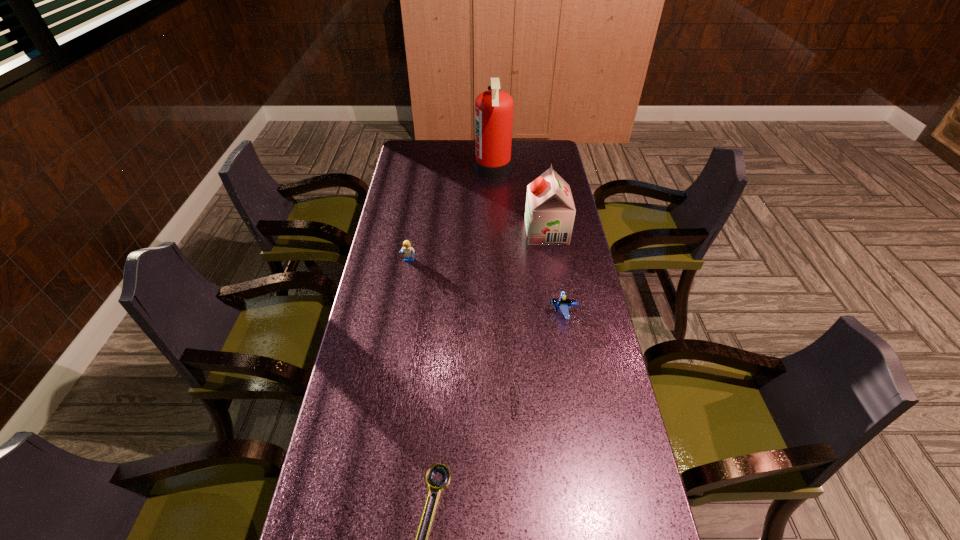
This screenshot has width=960, height=540. Find the location of `free space located 0.340m on the front-facing side of the second shortest object`. free space located 0.340m on the front-facing side of the second shortest object is located at coordinates (388, 402).

Where is `vacant area located 0.230m on the front-facing side of the second shortest object`? vacant area located 0.230m on the front-facing side of the second shortest object is located at coordinates (429, 402).

You are a GUI agent. You are given a task and a screenshot of the screen. Output one action in this format:
    pyautogui.click(x=<x>, y=<y>)
    Task: Click on the free point located 0.340m on the front-facing side of the second shortest object
    This screenshot has width=960, height=540.
    Given the screenshot: What is the action you would take?
    pyautogui.click(x=388, y=402)

Where is `object present at the far edge`? The height and width of the screenshot is (540, 960). object present at the far edge is located at coordinates (493, 109).

Find the location of a particular element. The height and width of the screenshot is (540, 960). object present at the left edge is located at coordinates (408, 250).

The image size is (960, 540). In order to click on soya milk positioned at the right edge in this screenshot , I will do `click(550, 211)`.

Find the location of a particular element. This screenshot has height=540, width=960. Lego that is positioned at the right edge is located at coordinates (564, 304).

Find the location of a particular element. vacant space at the left edge of the desktop is located at coordinates (390, 294).

Locate an element on the screen. The width and height of the screenshot is (960, 540). free space at the right edge of the desktop is located at coordinates (578, 264).

In the image, there is a desktop. Identify the location of vacant space at the far left corner. (411, 140).